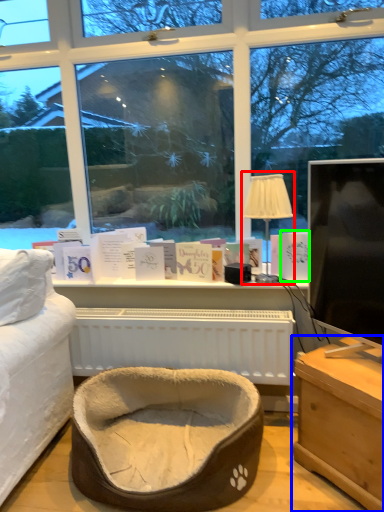
Question: Which object is the closest to the table lamp (highlighted by a red box)? Choose among these: table (highlighted by a blue box) or book (highlighted by a green box).

Choices:
 (A) table
 (B) book

Answer: (B)